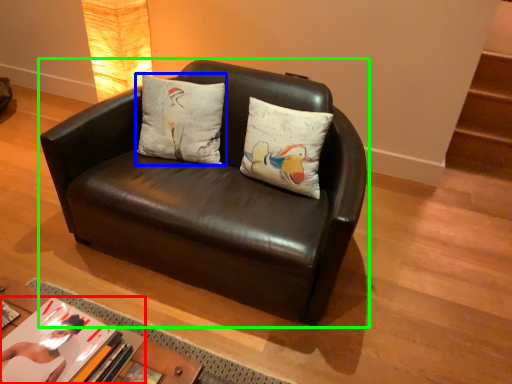
Question: Based on their relative distances, which object is farther from book (highlighted by a red box)? Choose from pillow (highlighted by a blue box) and studio couch (highlighted by a green box).

Choices:
 (A) pillow
 (B) studio couch

Answer: (A)